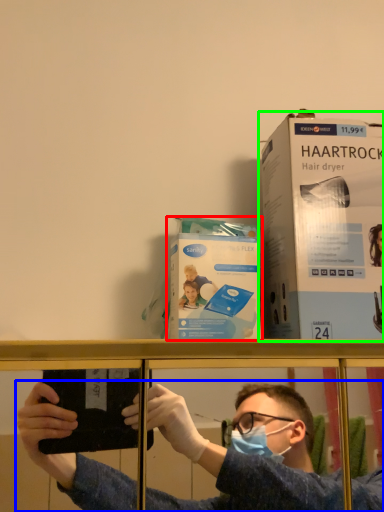
Question: Estimate the real-world distances between objects in this image. Which object is farther from paperback book (highlighted by a red box), person (highlighted by a blue box) or paperback book (highlighted by a green box)?

Choices:
 (A) person
 (B) paperback book

Answer: (A)